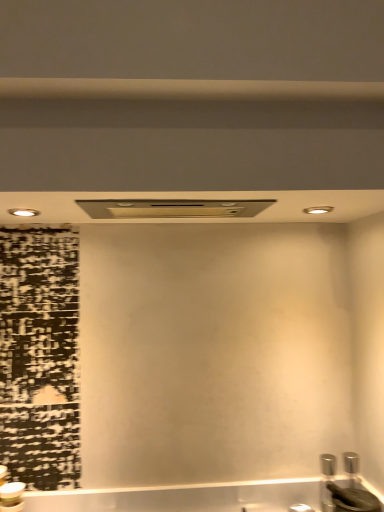
Question: Based on their positions, is satin nickel exhaust hood at center located to the left or right of black matte sink at lower right?

Choices:
 (A) right
 (B) left

Answer: (B)

Question: Is satin nickel exhaust hood at center taller or shorter than black matte sink at lower right?

Choices:
 (A) tall
 (B) short

Answer: (B)

Question: Based on their relative distances, which object is farther from the black matte sink at lower right?

Choices:
 (A) satin nickel exhaust hood at center
 (B) beige matte beam at upper center

Answer: (B)

Question: Which is farther from the satin nickel exhaust hood at center?

Choices:
 (A) beige matte beam at upper center
 (B) black matte sink at lower right

Answer: (B)